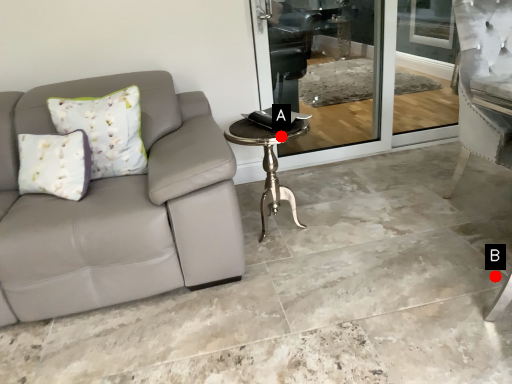
Question: Two points are circled on the image, labeled by A and B beside each circle. Among these points, which one is nearest to the camera?

Choices:
 (A) A is closer
 (B) B is closer

Answer: (B)